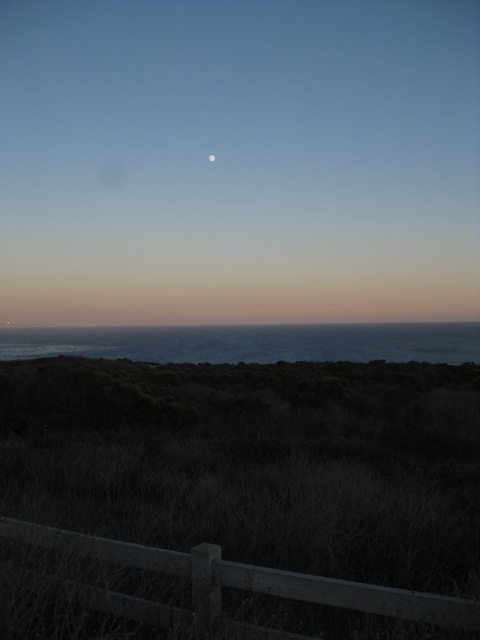
What is the location of the matte blue sky at upper center in the image?

The matte blue sky at upper center is located at point (x=239, y=161).

You are a photographer standing at the edge of the coast, and you want to take a photo of the white matte moon at upper center. However, the brown wooden fence at lower center is blocking your view. Can you move to a position where you can see the moon without the fence blocking it?

The brown wooden fence at lower center is in front of the white matte moon at upper center, so moving to a position where the fence is no longer between you and the moon would allow you to see it without obstruction. For example, moving to the left or right of the fence or adjusting your angle might provide an unobstructed view.

You are standing at the edge of a cliff overlooking the ocean. You see a point marked at coordinates point (239, 161). Based on the scene description, what is the color and location of the object at this point?

The point (239, 161) indicates matte blue sky at upper center.